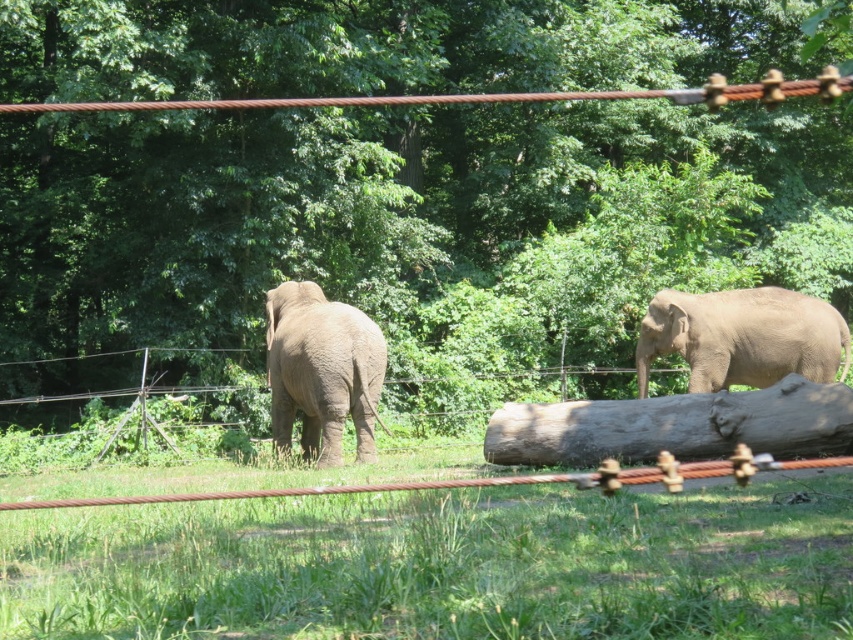
You are a zookeeper planning to place a new feeding station in the enclosure. The feeding station needs to be placed between the gray rough log at center and the gray matte elephant at right. Which object should the feeding station be closer to if it must be positioned closer to the object that is nearer to the viewer?

The feeding station should be placed closer to the gray rough log at center because it is nearer to the viewer compared to the gray matte elephant at right.

You are a zookeeper planning to feed the gray matte elephant at right and the gray matte elephant at center. If you want to give the smaller elephant more food, which one should you give it to?

The gray matte elephant at right has a smaller size compared to the gray matte elephant at center, so you should give the extra food to the gray matte elephant at right.

You are a zookeeper planning to install a new water fountain in the enclosure. The water fountain needs to be placed between the green leafy tree at center and the gray matte elephant at center so that it is closer to the taller object. Where should the water fountain be placed?

The green leafy tree at center is much taller than the gray matte elephant at center, so the water fountain should be placed closer to the green leafy tree at center.